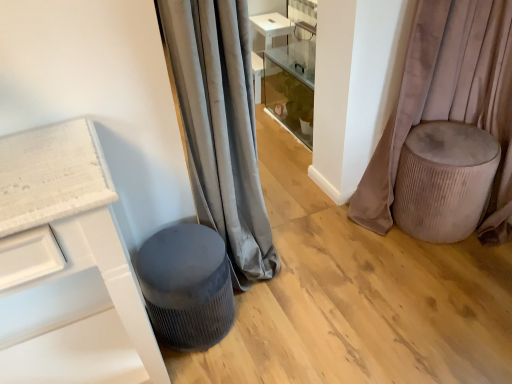
Question: From a real-world perspective, is velvet beige stool at right, the first curtain positioned from the right, beneath velvet grey stool at lower left?

Choices:
 (A) no
 (B) yes

Answer: (A)

Question: Is velvet beige stool at right, the 2th curtain positioned from the left, shorter than velvet grey stool at lower left?

Choices:
 (A) no
 (B) yes

Answer: (A)

Question: Does velvet beige stool at right, the first curtain positioned from the right, have a larger size compared to velvet grey stool at lower left?

Choices:
 (A) no
 (B) yes

Answer: (B)

Question: Considering the relative sizes of velvet beige stool at right, the first curtain positioned from the right, and velvet grey stool at lower left in the image provided, is velvet beige stool at right, the first curtain positioned from the right, taller than velvet grey stool at lower left?

Choices:
 (A) no
 (B) yes

Answer: (B)

Question: Is velvet beige stool at right, the first curtain positioned from the right, closer to the viewer compared to velvet grey stool at lower left?

Choices:
 (A) no
 (B) yes

Answer: (A)

Question: Choose the correct answer: Is velvet beige ottoman at right inside velvet beige stool at right, the first curtain positioned from the right, or outside it?

Choices:
 (A) inside
 (B) outside

Answer: (A)

Question: Is velvet beige ottoman at right to the left or to the right of velvet beige stool at right, the 2th curtain positioned from the left, in the image?

Choices:
 (A) left
 (B) right

Answer: (B)

Question: From the image's perspective, is velvet beige ottoman at right located above or below velvet beige stool at right, the first curtain positioned from the right?

Choices:
 (A) below
 (B) above

Answer: (A)

Question: Is velvet beige ottoman at right wider or thinner than velvet beige stool at right, the first curtain positioned from the right?

Choices:
 (A) wide
 (B) thin

Answer: (A)

Question: Is point (437, 54) positioned closer to the camera than point (216, 117)?

Choices:
 (A) closer
 (B) farther

Answer: (B)

Question: From a real-world perspective, is velvet beige stool at right, the 2th curtain positioned from the left, positioned above or below gray velvet curtain at center, which is the 1th curtain from left to right?

Choices:
 (A) below
 (B) above

Answer: (A)

Question: From the image's perspective, is velvet beige stool at right, the first curtain positioned from the right, positioned above or below gray velvet curtain at center, which is the 1th curtain from left to right?

Choices:
 (A) above
 (B) below

Answer: (A)

Question: In terms of height, does velvet beige stool at right, the 2th curtain positioned from the left, look taller or shorter compared to gray velvet curtain at center, the 2th curtain when ordered from right to left?

Choices:
 (A) short
 (B) tall

Answer: (A)

Question: From a real-world perspective, relative to velvet grey stool at lower left, is velvet beige ottoman at right vertically above or below?

Choices:
 (A) above
 (B) below

Answer: (A)

Question: Relative to velvet grey stool at lower left, is velvet beige ottoman at right in front or behind?

Choices:
 (A) behind
 (B) front

Answer: (A)